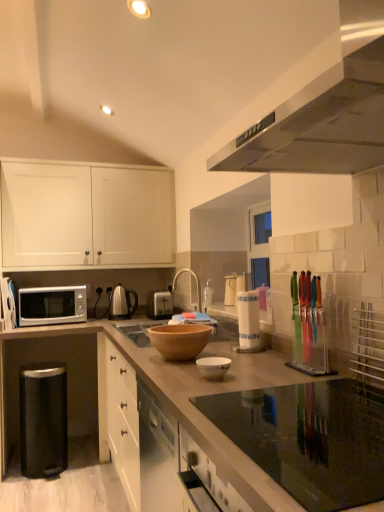
Find the location of a particular element. free spot in front of black matte trash can at lower left is located at coordinates (41, 490).